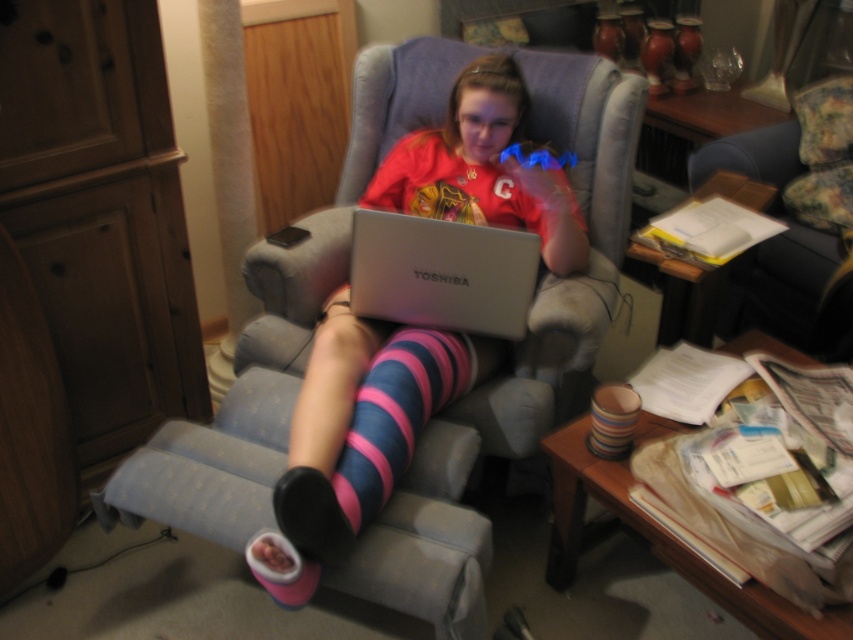
You are a fashion designer observing the image and want to create a matching accessory for the person. Since the pink striped socks at center and the pink striped sock at center are close to each other, how far apart are they?

The pink striped socks at center is 2.32 centimeters away from pink striped sock at center.

You are a delivery robot trying to deliver a package to the person sitting in the recliner chair. The package needs to be placed on the silver metallic laptop at center. However, the pink striped socks at center are blocking the way. Can you move the package around the socks to reach the laptop?

The pink striped socks at center is in front of the silver metallic laptop at center, so you can move the package around the socks to the side or behind them to reach the laptop.